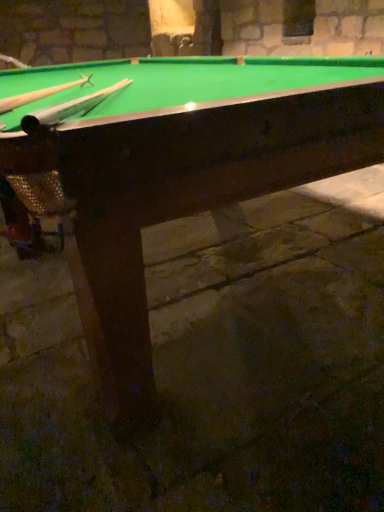
Question: Based on their positions, is green felt billiard table at center located to the left or right of wooden cue at upper left, which is the 2th cue in right-to-left order?

Choices:
 (A) left
 (B) right

Answer: (B)

Question: From a real-world perspective, is green felt billiard table at center physically located above or below wooden cue at upper left, which is the 2th cue in right-to-left order?

Choices:
 (A) above
 (B) below

Answer: (B)

Question: Which is nearer to the wooden cue at upper left, which is the 2th cue in right-to-left order?

Choices:
 (A) wooden cue at upper left, which is the second cue in left-to-right order
 (B) green felt billiard table at center

Answer: (A)

Question: Which object is the farthest from the wooden cue at upper left, which is the second cue in left-to-right order?

Choices:
 (A) wooden cue at upper left, arranged as the 1th cue when viewed from the left
 (B) green felt billiard table at center

Answer: (B)